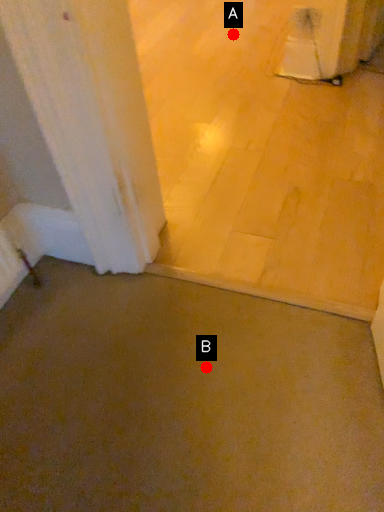
Question: Two points are circled on the image, labeled by A and B beside each circle. Which of the following is the farthest from the observer?

Choices:
 (A) A is further
 (B) B is further

Answer: (A)